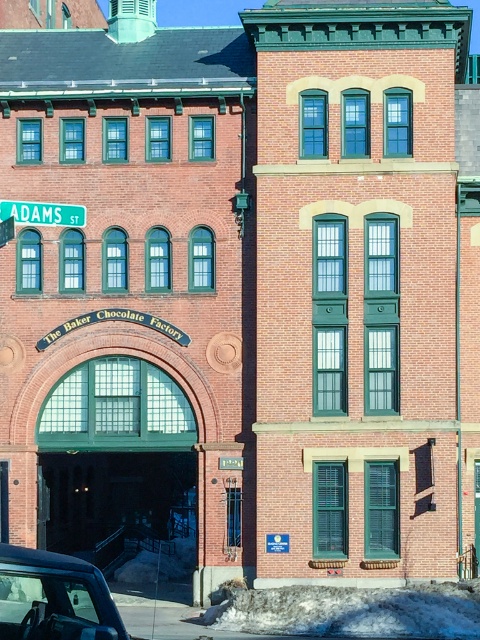
Question: Which of the following is the farthest from the observer?

Choices:
 (A) green plastic street sign at upper left
 (B) metallic gray car at lower left

Answer: (A)

Question: Can you confirm if metallic gray car at lower left is positioned to the left of green plastic street sign at upper left?

Choices:
 (A) yes
 (B) no

Answer: (B)

Question: Where is metallic gray car at lower left located in relation to green plastic street sign at upper left in the image?

Choices:
 (A) below
 (B) above

Answer: (A)

Question: Is metallic gray car at lower left closer to camera compared to green plastic street sign at upper left?

Choices:
 (A) yes
 (B) no

Answer: (A)